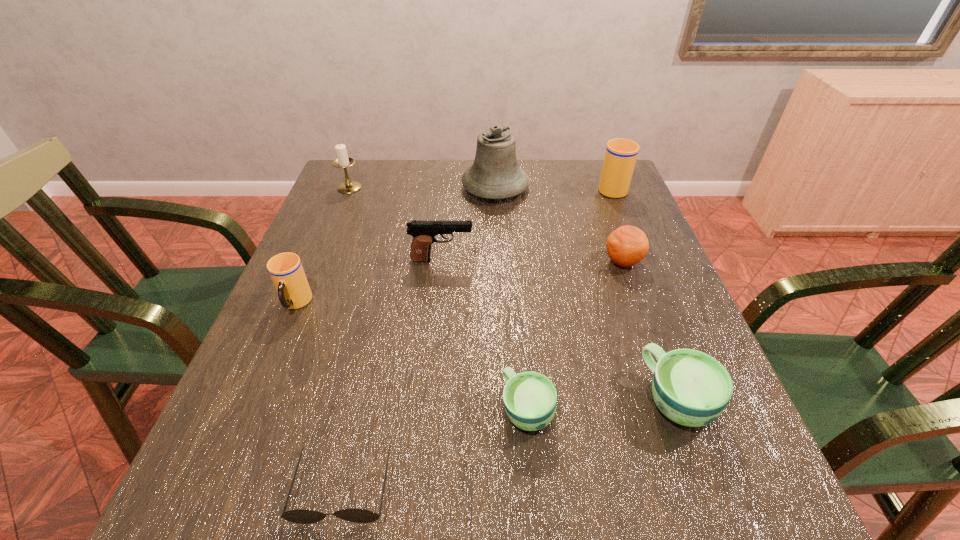
Where is `bell`? This screenshot has height=540, width=960. bell is located at coordinates (495, 174).

In order to click on the farthest cup in this screenshot , I will do `click(621, 154)`.

Find the location of a particular element. the right beige cup is located at coordinates (621, 154).

I want to click on candle holder, so click(343, 161).

Image resolution: width=960 pixels, height=540 pixels. Identify the location of pistol. (423, 232).

Where is `the third nearest cup`? The height and width of the screenshot is (540, 960). the third nearest cup is located at coordinates (286, 271).

Find the location of `the sixth farthest object`. the sixth farthest object is located at coordinates (286, 271).

Find the location of a particular element. orange orange is located at coordinates (628, 245).

Image resolution: width=960 pixels, height=540 pixels. I want to click on the right blue cup, so pyautogui.click(x=691, y=388).

The width and height of the screenshot is (960, 540). What are the coordinates of `the bigger blue cup` in the screenshot? It's located at (691, 388).